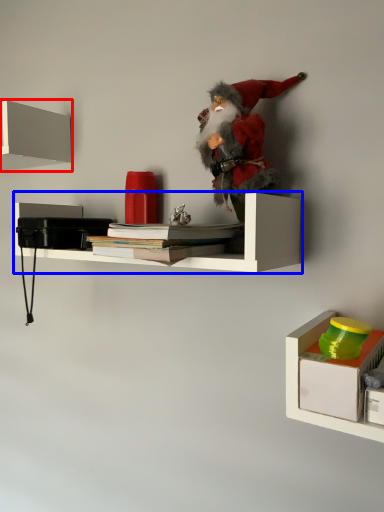
Question: Which object appears farthest to the camera in this image, shelf (highlighted by a red box) or shelf (highlighted by a blue box)?

Choices:
 (A) shelf
 (B) shelf

Answer: (A)